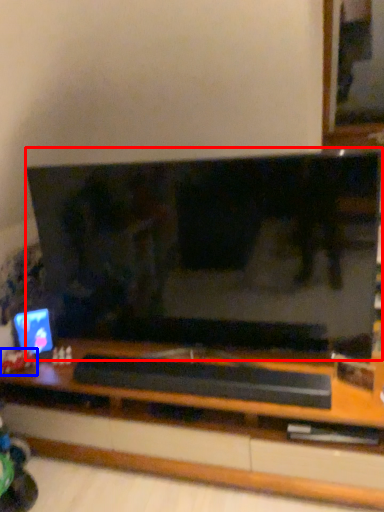
Question: Which point is closer to the camera, television (highlighted by a red box) or toy (highlighted by a blue box)?

Choices:
 (A) television
 (B) toy

Answer: (A)